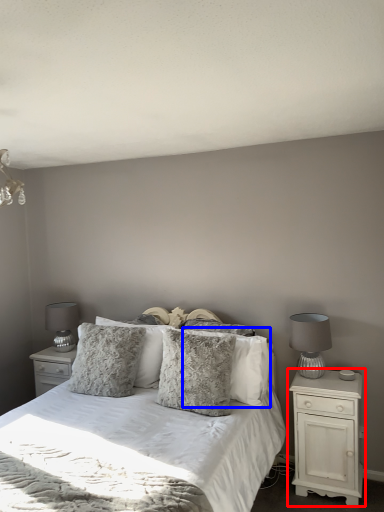
Question: Which object appears farthest to the camera in this image, nightstand (highlighted by a red box) or pillow (highlighted by a blue box)?

Choices:
 (A) nightstand
 (B) pillow

Answer: (B)